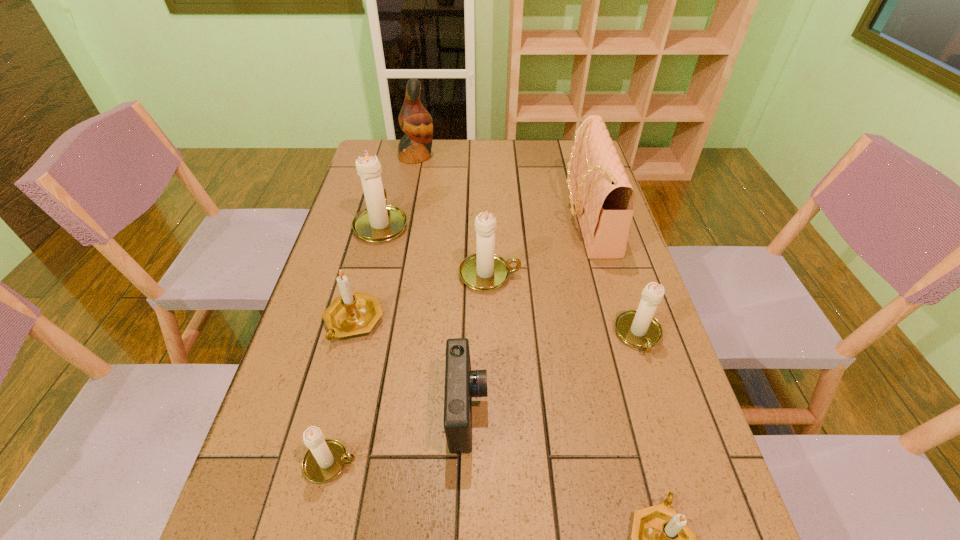
Where is `the third biggest white candle holder`? This screenshot has width=960, height=540. the third biggest white candle holder is located at coordinates (638, 328).

Locate an element on the screen. Image resolution: width=960 pixels, height=540 pixels. blue camera is located at coordinates (461, 383).

Image resolution: width=960 pixels, height=540 pixels. Identify the location of the nearest white candle holder. (324, 461).

Where is `the second nearest candle holder`? This screenshot has width=960, height=540. the second nearest candle holder is located at coordinates (324, 461).

Locate an element on the screen. free location located 0.340m on the face of the parrot is located at coordinates (528, 156).

Where is `vacant space located 0.290m on the handle side of the farthest white candle holder`? vacant space located 0.290m on the handle side of the farthest white candle holder is located at coordinates (398, 158).

I want to click on vacant area situated 0.350m on the handle side of the farthest white candle holder, so click(400, 149).

Locate an element on the screen. vacant space located 0.400m on the handle side of the farthest white candle holder is located at coordinates (402, 143).

Find the location of `vacant area situated 0.270m on the front-facing side of the handbag`. vacant area situated 0.270m on the front-facing side of the handbag is located at coordinates (478, 217).

Find the location of a particular element. The width and height of the screenshot is (960, 540). vacant point located on the front-facing side of the handbag is located at coordinates (466, 217).